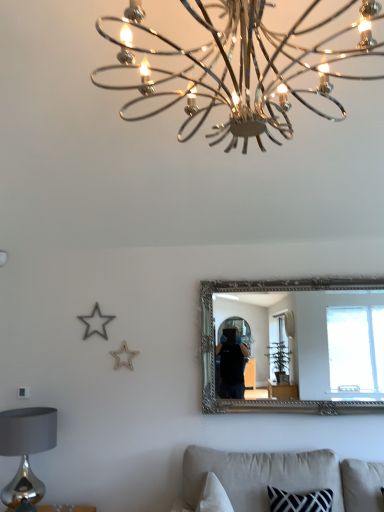
Question: Can you confirm if shiny silver table lamp at lower left is positioned to the right of beige fabric couch at lower center?

Choices:
 (A) no
 (B) yes

Answer: (A)

Question: Could you tell me if shiny silver table lamp at lower left is turned towards beige fabric couch at lower center?

Choices:
 (A) no
 (B) yes

Answer: (A)

Question: Considering the relative positions of shiny silver table lamp at lower left and beige fabric couch at lower center in the image provided, is shiny silver table lamp at lower left behind beige fabric couch at lower center?

Choices:
 (A) yes
 (B) no

Answer: (A)

Question: Is shiny silver table lamp at lower left next to beige fabric couch at lower center and touching it?

Choices:
 (A) no
 (B) yes

Answer: (A)

Question: Is shiny silver table lamp at lower left shorter than beige fabric couch at lower center?

Choices:
 (A) yes
 (B) no

Answer: (B)

Question: Can you confirm if shiny silver table lamp at lower left is positioned to the left of beige fabric couch at lower center?

Choices:
 (A) no
 (B) yes

Answer: (B)

Question: Is chrome/metallic chandelier at upper center taller than silver ornate mirror at center?

Choices:
 (A) no
 (B) yes

Answer: (A)

Question: Considering the relative sizes of chrome/metallic chandelier at upper center and silver ornate mirror at center in the image provided, is chrome/metallic chandelier at upper center thinner than silver ornate mirror at center?

Choices:
 (A) no
 (B) yes

Answer: (A)

Question: Can you confirm if chrome/metallic chandelier at upper center is smaller than silver ornate mirror at center?

Choices:
 (A) yes
 (B) no

Answer: (B)

Question: From a real-world perspective, is chrome/metallic chandelier at upper center located beneath silver ornate mirror at center?

Choices:
 (A) yes
 (B) no

Answer: (B)

Question: Is chrome/metallic chandelier at upper center at the left side of silver ornate mirror at center?

Choices:
 (A) no
 (B) yes

Answer: (B)

Question: Is chrome/metallic chandelier at upper center in front of silver ornate mirror at center?

Choices:
 (A) no
 (B) yes

Answer: (B)

Question: Is silver ornate mirror at center far from shiny silver table lamp at lower left?

Choices:
 (A) no
 (B) yes

Answer: (B)